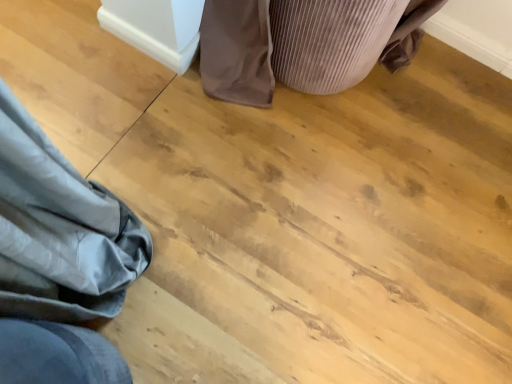
What do you see at coordinates (237, 51) in the screenshot? The height and width of the screenshot is (384, 512). I see `velvet beige bean bag chair at upper right` at bounding box center [237, 51].

Identify the location of velvet beige bean bag chair at upper right. (237, 51).

Identify the location of velvet beige bean bag chair at upper right. (237, 51).